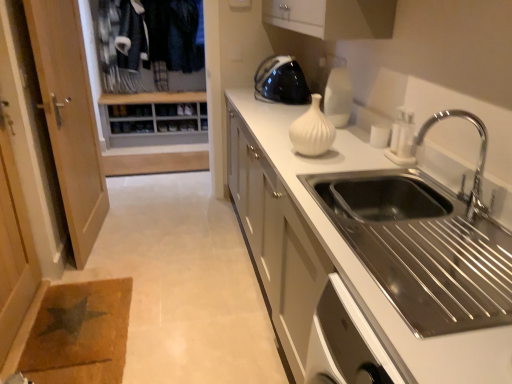
What do you see at coordinates (69, 117) in the screenshot? I see `wooden door at left` at bounding box center [69, 117].

Locate an element on the screen. This screenshot has height=384, width=512. wooden shoe rack at upper left is located at coordinates (151, 103).

You are a GUI agent. You are given a task and a screenshot of the screen. Output one action in this format:
    pyautogui.click(x=<x>, y=<y>)
    Task: Click on the white matte vase at center
    This screenshot has width=512, height=384.
    Given the screenshot: What is the action you would take?
    coord(312,131)

What do you see at coordinates (478, 159) in the screenshot? The width and height of the screenshot is (512, 384). I see `chrome metallic faucet at upper right` at bounding box center [478, 159].

The width and height of the screenshot is (512, 384). I want to click on wooden door at left, so click(69, 117).

Can you confirm if wooden screen door at left is taller than white matte vase at center?

Correct, wooden screen door at left is much taller as white matte vase at center.

Is wooden screen door at left thinner than white matte vase at center?

Yes, wooden screen door at left is thinner than white matte vase at center.

What's the angular difference between wooden screen door at left and white matte vase at center's facing directions?

They differ by 179 degrees in their facing directions.

Based on the photo, is white matte vase at center at the back of wooden screen door at left?

That's not correct — wooden screen door at left is not looking away from white matte vase at center.

Which object is positioned more to the left, chrome metallic faucet at upper right or wooden door at left?

wooden door at left.

Is chrome metallic faucet at upper right taller or shorter than wooden door at left?

In the image, chrome metallic faucet at upper right appears to be shorter than wooden door at left.

Considering the relative sizes of chrome metallic faucet at upper right and wooden door at left in the image provided, is chrome metallic faucet at upper right wider than wooden door at left?

Yes, chrome metallic faucet at upper right is wider than wooden door at left.

From the image's perspective, which one is positioned lower, chrome metallic faucet at upper right or wooden door at left?

chrome metallic faucet at upper right.

Between wooden shoe rack at upper left and white glossy vase at upper center, which one is positioned in front?

Positioned in front is white glossy vase at upper center.

From the image's perspective, does wooden shoe rack at upper left appear higher than white glossy vase at upper center?

Yes, from the image's perspective, wooden shoe rack at upper left is above white glossy vase at upper center.

From a real-world perspective, is wooden shoe rack at upper left located higher than white glossy vase at upper center?

No.

Visually, is wooden shoe rack at upper left positioned to the left or to the right of white glossy vase at upper center?

From the image, it's evident that wooden shoe rack at upper left is to the left of white glossy vase at upper center.

From the picture: Does stainless steel sink at right come in front of wooden door at left?

Yes, stainless steel sink at right is closer to the camera.

Is stainless steel sink at right outside of wooden door at left?

stainless steel sink at right is positioned outside wooden door at left.

Who is shorter, stainless steel sink at right or wooden door at left?

stainless steel sink at right is shorter.

Which of these two, white glossy vase at upper center or chrome metallic faucet at upper right, is smaller?

Smaller between the two is white glossy vase at upper center.

Are white glossy vase at upper center and chrome metallic faucet at upper right making contact?

No, white glossy vase at upper center is not next to chrome metallic faucet at upper right.

How distant is white glossy vase at upper center from chrome metallic faucet at upper right?

23.55 inches.

At what (x,y) coordinates should I click in order to perform the action: click on appliance above the chrome metallic faucet at upper right (from the image's perspective). Please return your answer as a coordinate pair (x, y). The height and width of the screenshot is (384, 512). Looking at the image, I should click on (338, 97).

Who is shorter, wooden screen door at left or stainless steel sink at right?

stainless steel sink at right.

In terms of width, does wooden screen door at left look wider or thinner when compared to stainless steel sink at right?

In the image, wooden screen door at left appears to be wider than stainless steel sink at right.

Which object is positioned more to the left, wooden screen door at left or stainless steel sink at right?

Positioned to the left is wooden screen door at left.

Considering the relative sizes of wooden screen door at left and stainless steel sink at right in the image provided, is wooden screen door at left bigger than stainless steel sink at right?

Yes, wooden screen door at left is bigger than stainless steel sink at right.

Where is `tap located below the white glossy vase at upper center (from the image's perspective)`? tap located below the white glossy vase at upper center (from the image's perspective) is located at coordinates (478, 159).

From the image's perspective, is chrome metallic faucet at upper right beneath white glossy vase at upper center?

Yes.

Considering the sizes of objects chrome metallic faucet at upper right and white glossy vase at upper center in the image provided, who is bigger, chrome metallic faucet at upper right or white glossy vase at upper center?

Bigger between the two is chrome metallic faucet at upper right.

Between chrome metallic faucet at upper right and white glossy vase at upper center, which one has less height?

white glossy vase at upper center.

Locate an element on the screen. The height and width of the screenshot is (384, 512). screen door located on the left of white matte vase at center is located at coordinates (12, 209).

You are a GUI agent. You are given a task and a screenshot of the screen. Output one action in this format:
    pyautogui.click(x=<x>, y=<y>)
    Task: Click on the door beneath the chrome metallic faucet at upper right (from a real-world perspective)
    The height and width of the screenshot is (384, 512).
    Given the screenshot: What is the action you would take?
    pyautogui.click(x=69, y=117)

Estimate the real-world distances between objects in this image. Which object is closer to white glossy vase at upper center, wooden door at left or stainless steel sink at right?

stainless steel sink at right lies closer to white glossy vase at upper center than the other object.

Looking at the image, which one is located closer to black glossy kettle at upper center, chrome metallic faucet at upper right or wooden door at left?

chrome metallic faucet at upper right.

From the image, which object appears to be nearer to white glossy vase at upper center, white matte vase at center or wooden shoe rack at upper left?

white matte vase at center is closer to white glossy vase at upper center.

When comparing their distances from white matte countertop at center, does wooden door at left or white glossy vase at upper center seem further?

wooden door at left lies further to white matte countertop at center than the other object.

From the image, which object appears to be farther from chrome metallic faucet at upper right, white glossy vase at upper center or stainless steel sink at right?

white glossy vase at upper center.

When comparing their distances from chrome metallic faucet at upper right, does wooden screen door at left or white matte vase at center seem further?

Based on the image, wooden screen door at left appears to be further to chrome metallic faucet at upper right.

Based on their spatial positions, is wooden shoe rack at upper left or chrome metallic faucet at upper right closer to wooden screen door at left?

chrome metallic faucet at upper right is positioned closer to the anchor wooden screen door at left.

Based on their spatial positions, is stainless steel sink at right or wooden door at left closer to white glossy vase at upper center?

The object closer to white glossy vase at upper center is stainless steel sink at right.

You are a GUI agent. You are given a task and a screenshot of the screen. Output one action in this format:
    pyautogui.click(x=<x>, y=<y>)
    Task: Click on the door between wooden screen door at left and white matte countertop at center in the horizontal direction
    
    Given the screenshot: What is the action you would take?
    pyautogui.click(x=69, y=117)

In order to click on vase between chrome metallic faucet at upper right and wooden shoe rack at upper left along the z-axis in this screenshot , I will do `click(312, 131)`.

Where is `vase between chrome metallic faucet at upper right and black glossy kettle at upper center along the z-axis`? The height and width of the screenshot is (384, 512). vase between chrome metallic faucet at upper right and black glossy kettle at upper center along the z-axis is located at coordinates (312, 131).

The height and width of the screenshot is (384, 512). Identify the location of vase between chrome metallic faucet at upper right and white glossy vase at upper center along the z-axis. (312, 131).